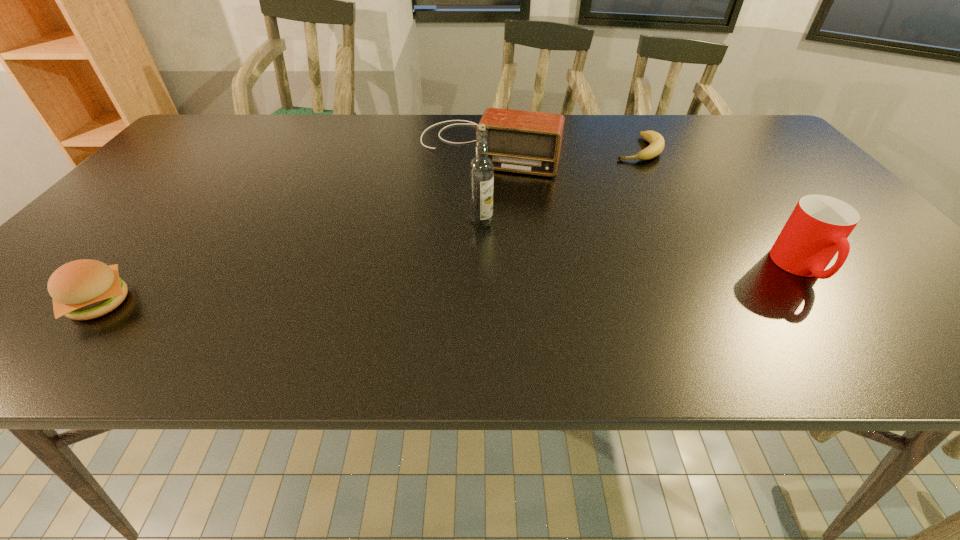
Find the location of a particular element. This screenshot has height=540, width=960. vacant space in between the leftmost object and the tallest object is located at coordinates (290, 263).

Identify the location of vacant point located between the radio receiver and the shortest object. (563, 148).

The height and width of the screenshot is (540, 960). I want to click on unoccupied position between the radio receiver and the hamburger, so click(x=294, y=225).

Locate an element on the screen. This screenshot has height=540, width=960. unoccupied position between the shortest object and the rightmost object is located at coordinates (719, 208).

In order to click on free spot between the radio receiver and the rightmost object in this screenshot , I will do `click(644, 207)`.

Identify the location of free point between the banana and the tallest object. The width and height of the screenshot is (960, 540). (560, 186).

What are the coordinates of `free spot between the cup and the fourth object from left to right` in the screenshot? It's located at (719, 208).

The height and width of the screenshot is (540, 960). I want to click on empty space between the rightmost object and the vodka, so click(x=641, y=246).

Locate an element on the screen. Image resolution: width=960 pixels, height=540 pixels. the third closest object relative to the radio receiver is located at coordinates (818, 228).

Identify which object is located as the nearest to the radio receiver. Please provide its 2D coordinates. Your answer should be formatted as a tuple, i.e. [(x, y)], where the tuple contains the x and y coordinates of a point satisfying the conditions above.

[(657, 143)]